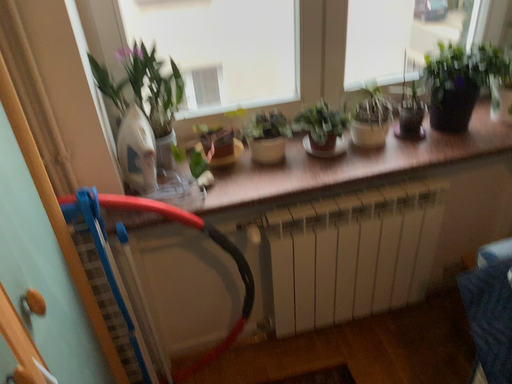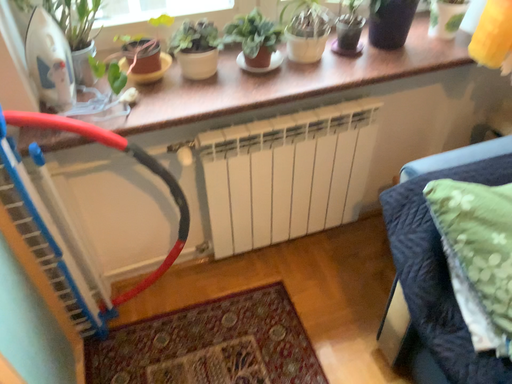
Question: How did the camera likely rotate when shooting the video?

Choices:
 (A) rotated downward
 (B) rotated upward

Answer: (A)